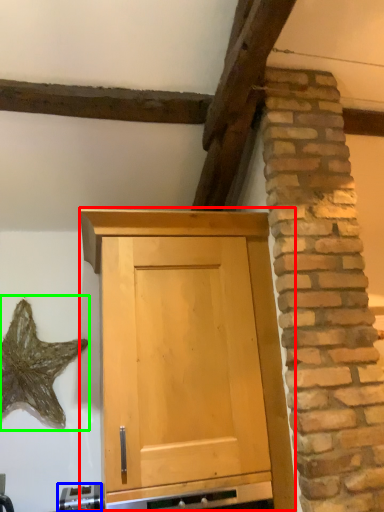
Question: Considering the real-world distances, which object is closest to cupboard (highlighted by a red box)? appliance (highlighted by a blue box) or star (highlighted by a green box).

Choices:
 (A) appliance
 (B) star

Answer: (A)